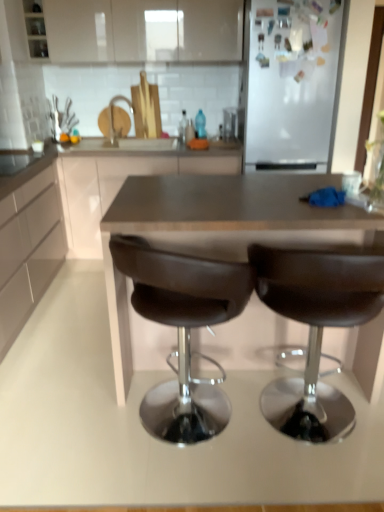
Question: Should I look upward or downward to see dark brown laminate counter at center?

Choices:
 (A) down
 (B) up

Answer: (B)

Question: From a real-world perspective, is matte brown countertop at center, the 2th cabinetry from the top, physically above brown leather table at center?

Choices:
 (A) yes
 (B) no

Answer: (A)

Question: From a real-world perspective, is matte brown countertop at center, the 2th cabinetry when ordered from bottom to top, physically below brown leather table at center?

Choices:
 (A) yes
 (B) no

Answer: (B)

Question: Could you tell me if matte brown countertop at center, the 2th cabinetry from the top, is turned towards brown leather table at center?

Choices:
 (A) no
 (B) yes

Answer: (B)

Question: Considering the relative positions of matte brown countertop at center, the 2th cabinetry from the top, and brown leather table at center in the image provided, is matte brown countertop at center, the 2th cabinetry from the top, to the left of brown leather table at center from the viewer's perspective?

Choices:
 (A) no
 (B) yes

Answer: (B)

Question: Is matte brown countertop at center, the 2th cabinetry when ordered from bottom to top, bigger than brown leather table at center?

Choices:
 (A) no
 (B) yes

Answer: (B)

Question: Does matte brown countertop at center, the 2th cabinetry when ordered from bottom to top, have a smaller size compared to brown leather table at center?

Choices:
 (A) no
 (B) yes

Answer: (A)

Question: Is white glossy cabinet at upper center, marked as the 1th cabinetry in a top-to-bottom arrangement, beside white matte cabinet at left, the first cabinetry ordered from the bottom?

Choices:
 (A) yes
 (B) no

Answer: (B)

Question: Is white glossy cabinet at upper center, which appears as the 3th cabinetry when ordered from the bottom, at the left side of white matte cabinet at left, the first cabinetry ordered from the bottom?

Choices:
 (A) yes
 (B) no

Answer: (B)

Question: Is white glossy cabinet at upper center, which appears as the 3th cabinetry when ordered from the bottom, located outside white matte cabinet at left, the first cabinetry ordered from the bottom?

Choices:
 (A) no
 (B) yes

Answer: (B)

Question: Is white matte cabinet at left, the 3th cabinetry from the top, inside white glossy cabinet at upper center, which appears as the 3th cabinetry when ordered from the bottom?

Choices:
 (A) no
 (B) yes

Answer: (A)

Question: Are white glossy cabinet at upper center, marked as the 1th cabinetry in a top-to-bottom arrangement, and white matte cabinet at left, the first cabinetry ordered from the bottom, located far from each other?

Choices:
 (A) no
 (B) yes

Answer: (B)

Question: Does white glossy cabinet at upper center, marked as the 1th cabinetry in a top-to-bottom arrangement, have a smaller size compared to white matte cabinet at left, the 3th cabinetry from the top?

Choices:
 (A) no
 (B) yes

Answer: (B)

Question: Is the depth of brown leather chair at center, which is the second chair in right-to-left order, less than that of white glossy cabinet at upper center, which appears as the 3th cabinetry when ordered from the bottom?

Choices:
 (A) no
 (B) yes

Answer: (B)